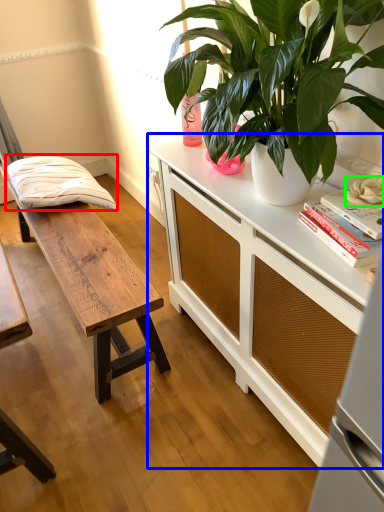
Question: Which object is the farthest from pillow (highlighted by a red box)? Choose among these: cabinetry (highlighted by a blue box) or flower (highlighted by a green box).

Choices:
 (A) cabinetry
 (B) flower

Answer: (B)